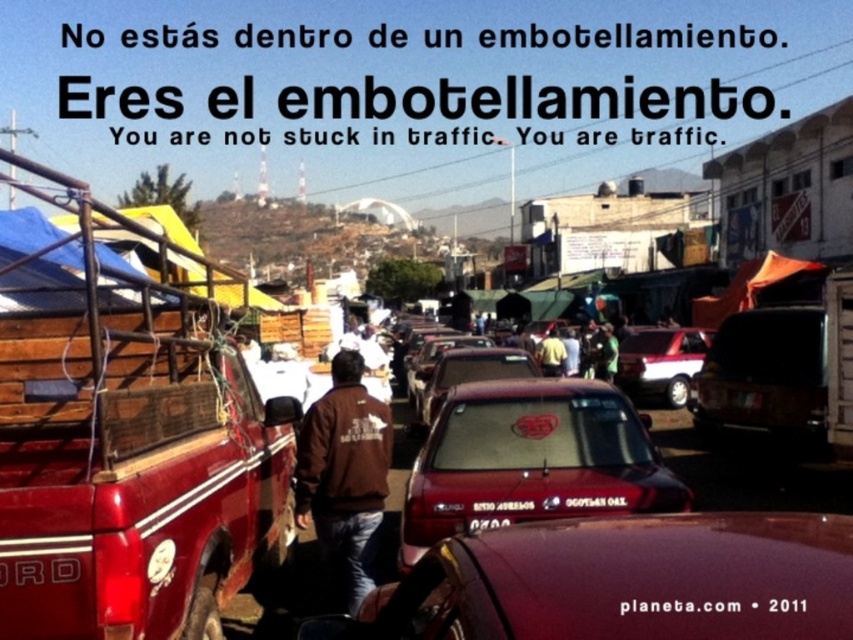
Is the position of metallic red car at center more distant than that of shiny red car at center?

No.

Can you confirm if metallic red car at center is shorter than shiny red car at center?

Yes, metallic red car at center is shorter than shiny red car at center.

Is point (807, 602) positioned behind point (413, 528)?

No, (807, 602) is closer to viewer.

The height and width of the screenshot is (640, 853). I want to click on metallic red car at center, so click(x=625, y=580).

Which of these two, brown leather jacket at center or metallic silver car at center, stands shorter?

metallic silver car at center is shorter.

Can you confirm if brown leather jacket at center is shorter than metallic silver car at center?

No, brown leather jacket at center is not shorter than metallic silver car at center.

Who is more forward, [318,509] or [624,344]?

Point [318,509] is in front.

I want to click on brown leather jacket at center, so click(344, 476).

Is shiny red car at center smaller than metallic silver car at center?

Correct, shiny red car at center occupies less space than metallic silver car at center.

Is point (676, 483) positioned after point (672, 401)?

No, it is not.

Identify the location of shiny red car at center. (531, 460).